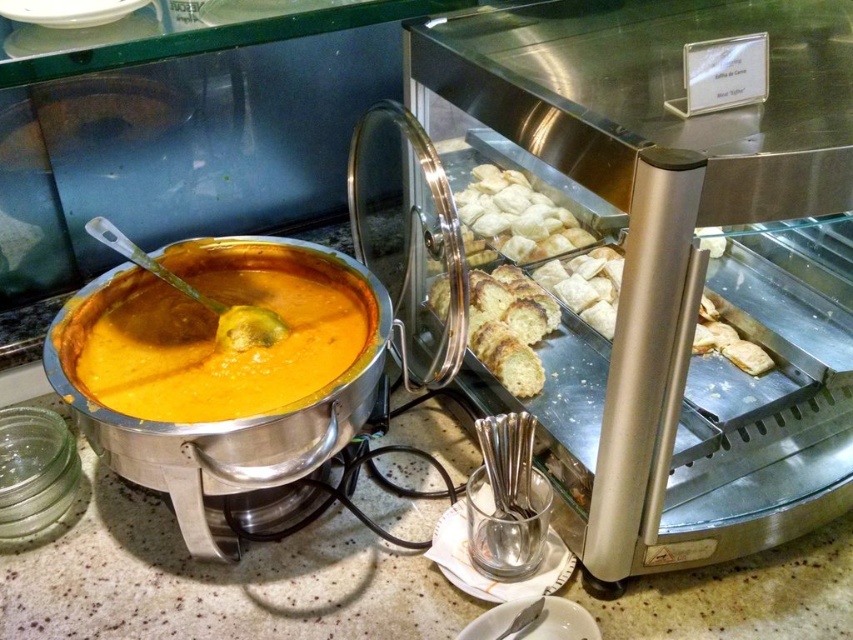
Is golden brown crumbly bread at center to the left of golden brown pastry at center from the viewer's perspective?

Correct, you'll find golden brown crumbly bread at center to the left of golden brown pastry at center.

Does point (476, 269) come closer to viewer compared to point (459, 218)?

No, it is not.

At what (x,y) coordinates should I click in order to perform the action: click on golden brown crumbly bread at center. Please return your answer as a coordinate pair (x, y). The height and width of the screenshot is (640, 853). Looking at the image, I should click on (509, 326).

Is the position of orange matte soup at center more distant than that of golden brown pastry at center?

No, it is not.

Who is more distant from viewer, (306, 340) or (495, 198)?

Positioned behind is point (495, 198).

Is point (312, 284) positioned before point (523, 180)?

Yes, it is.

The width and height of the screenshot is (853, 640). I want to click on orange matte soup at center, so click(x=213, y=333).

Which is behind, point (514, 307) or point (605, 324)?

The point (514, 307) is behind.

Can you confirm if golden brown crumbly bread at center is smaller than golden brown crumbly pastry at center?

Incorrect, golden brown crumbly bread at center is not smaller in size than golden brown crumbly pastry at center.

You are a GUI agent. You are given a task and a screenshot of the screen. Output one action in this format:
    pyautogui.click(x=<x>, y=<y>)
    Task: Click on the golden brown crumbly bread at center
    The image size is (853, 640).
    Given the screenshot: What is the action you would take?
    pyautogui.click(x=509, y=326)

The width and height of the screenshot is (853, 640). In order to click on golden brown crumbly bread at center in this screenshot , I will do `click(509, 326)`.